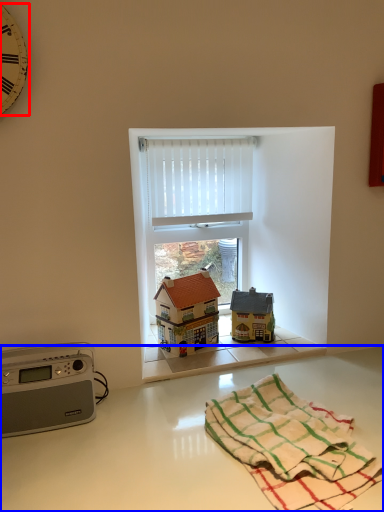
Question: Which object is further to the camera taking this photo, clock (highlighted by a red box) or counter top (highlighted by a blue box)?

Choices:
 (A) clock
 (B) counter top

Answer: (A)